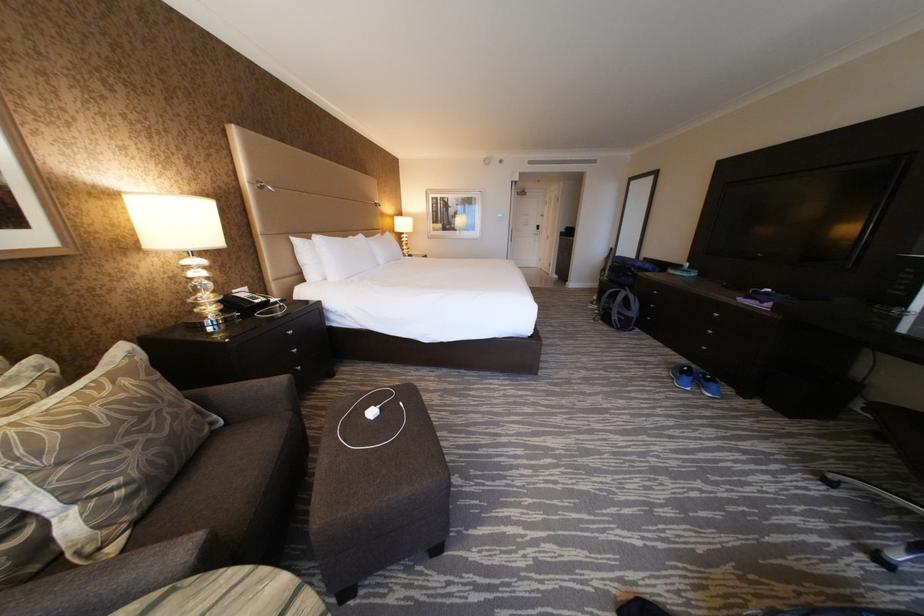
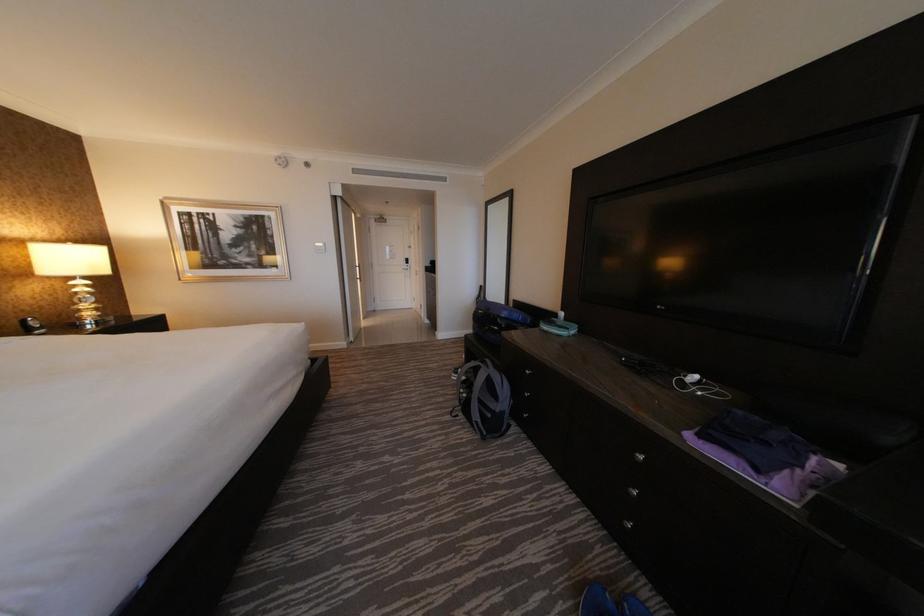
What movement of the cameraman would produce the second image?

The movement direction of the cameraman is right, forward.